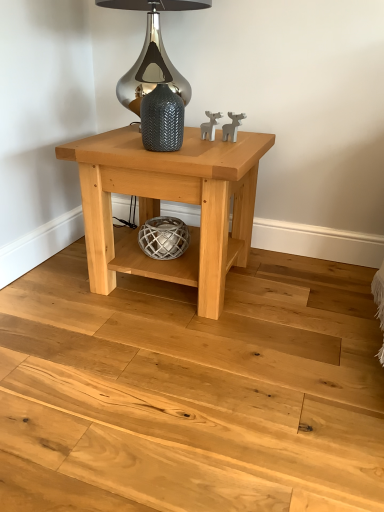
Locate an element on the screen. The image size is (384, 512). free point to the right of textured gray vase at center is located at coordinates (207, 152).